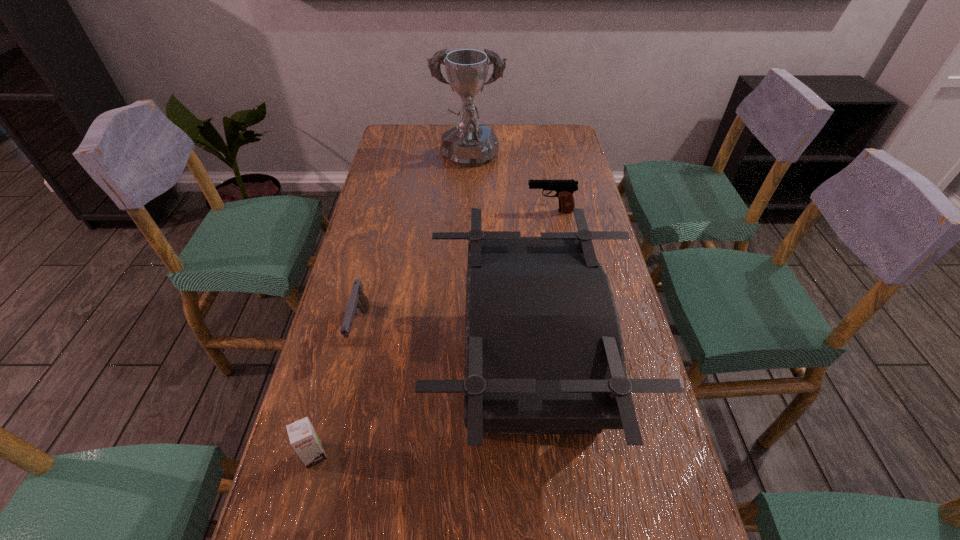
This screenshot has width=960, height=540. Identify the location of vacant space located with a camera mounted on the underside of the fourth shortest object. (408, 368).

I want to click on free space located at the barrel of the farther pistol, so click(429, 211).

The height and width of the screenshot is (540, 960). Identify the location of vacant area located 0.090m at the barrel of the farther pistol. (498, 211).

Identify the location of vacant space located 0.160m at the barrel of the farther pistol. The image size is (960, 540). (476, 211).

Find the location of `vacant position located on the right of the chocolate milk`. vacant position located on the right of the chocolate milk is located at coordinates (369, 455).

Where is `free spot located at the barrel of the nearer pistol`? Image resolution: width=960 pixels, height=540 pixels. free spot located at the barrel of the nearer pistol is located at coordinates (x=327, y=469).

In order to click on object at the far edge in this screenshot , I will do `click(468, 144)`.

The image size is (960, 540). What are the coordinates of `chocolate milk at the left edge` in the screenshot? It's located at (303, 437).

The width and height of the screenshot is (960, 540). I want to click on pistol at the left edge, so click(357, 300).

I want to click on drone located at the right edge, so click(x=544, y=354).